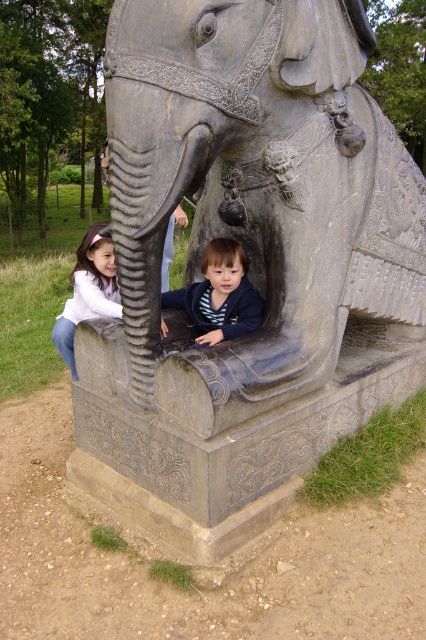
Question: Does dark blue fleece at lower center appear on the left side of matte white shirt at lower left?

Choices:
 (A) no
 (B) yes

Answer: (A)

Question: Can you confirm if gray stone elephant at center is positioned above matte white shirt at lower left?

Choices:
 (A) no
 (B) yes

Answer: (B)

Question: Is gray stone elephant at center below matte white shirt at lower left?

Choices:
 (A) no
 (B) yes

Answer: (A)

Question: Which point appears farthest from the camera in this image?

Choices:
 (A) (342, 262)
 (B) (169, 292)
 (C) (97, 280)

Answer: (C)

Question: Among these objects, which one is nearest to the camera?

Choices:
 (A) gray stone elephant at center
 (B) dark blue fleece at lower center
 (C) matte white shirt at lower left

Answer: (A)

Question: Which of the following is the farthest from the observer?

Choices:
 (A) dark blue fleece at lower center
 (B) matte white shirt at lower left
 (C) gray stone elephant at center

Answer: (B)